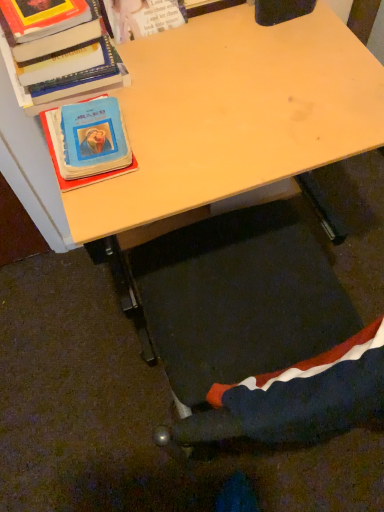
Question: Is velvet-like fabric swivel chair at lower center positioned beyond the bounds of blue matte book at left, the first book when ordered from bottom to top?

Choices:
 (A) yes
 (B) no

Answer: (A)

Question: From the image's perspective, is velvet-like fabric swivel chair at lower center under blue matte book at left, the first book when ordered from bottom to top?

Choices:
 (A) no
 (B) yes

Answer: (B)

Question: From the image's perspective, is velvet-like fabric swivel chair at lower center above blue matte book at left, the first book when ordered from bottom to top?

Choices:
 (A) no
 (B) yes

Answer: (A)

Question: Does velvet-like fabric swivel chair at lower center have a lesser height compared to blue matte book at left, arranged as the 2th book when viewed from the top?

Choices:
 (A) yes
 (B) no

Answer: (B)

Question: From a real-world perspective, is velvet-like fabric swivel chair at lower center beneath blue matte book at left, arranged as the 2th book when viewed from the top?

Choices:
 (A) no
 (B) yes

Answer: (B)

Question: Considering their positions, is blue matte book at left, the first book when ordered from bottom to top, located in front of or behind wooden desk at center?

Choices:
 (A) behind
 (B) front

Answer: (A)

Question: Considering the positions of blue matte book at left, arranged as the 2th book when viewed from the top, and wooden desk at center in the image, is blue matte book at left, arranged as the 2th book when viewed from the top, wider or thinner than wooden desk at center?

Choices:
 (A) thin
 (B) wide

Answer: (A)

Question: From a real-world perspective, relative to wooden desk at center, is blue matte book at left, the first book when ordered from bottom to top, vertically above or below?

Choices:
 (A) above
 (B) below

Answer: (A)

Question: Is blue matte book at left, the first book when ordered from bottom to top, taller or shorter than wooden desk at center?

Choices:
 (A) tall
 (B) short

Answer: (B)

Question: From the image's perspective, is blue matte book at left, arranged as the 2th book when viewed from the top, located above or below velvet-like fabric swivel chair at lower center?

Choices:
 (A) below
 (B) above

Answer: (B)

Question: Is point (67, 182) positioned closer to the camera than point (266, 407)?

Choices:
 (A) closer
 (B) farther

Answer: (B)

Question: Considering the positions of blue matte book at left, arranged as the 2th book when viewed from the top, and velvet-like fabric swivel chair at lower center in the image, is blue matte book at left, arranged as the 2th book when viewed from the top, wider or thinner than velvet-like fabric swivel chair at lower center?

Choices:
 (A) wide
 (B) thin

Answer: (A)

Question: Based on their sizes in the image, would you say blue matte book at left, arranged as the 2th book when viewed from the top, is bigger or smaller than velvet-like fabric swivel chair at lower center?

Choices:
 (A) small
 (B) big

Answer: (A)

Question: Considering the positions of point (349, 81) and point (48, 105), is point (349, 81) closer or farther from the camera than point (48, 105)?

Choices:
 (A) closer
 (B) farther

Answer: (B)

Question: Is wooden desk at center to the left or to the right of hardcover book at upper left, which is the second book in bottom-to-top order, in the image?

Choices:
 (A) right
 (B) left

Answer: (A)